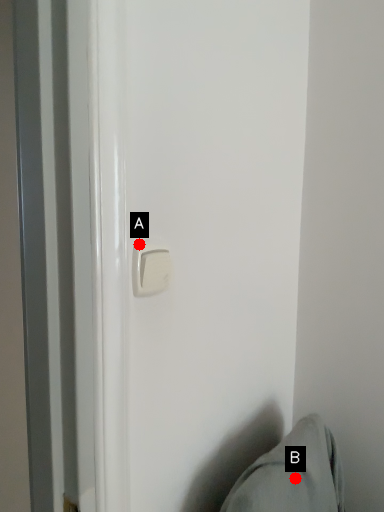
Question: Two points are circled on the image, labeled by A and B beside each circle. Which point is farther to the camera?

Choices:
 (A) A is further
 (B) B is further

Answer: (B)